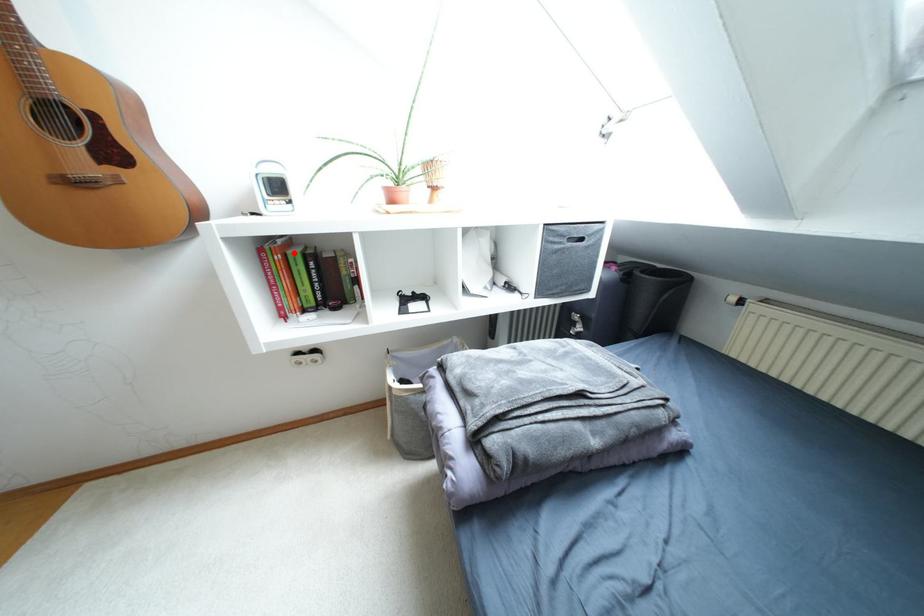
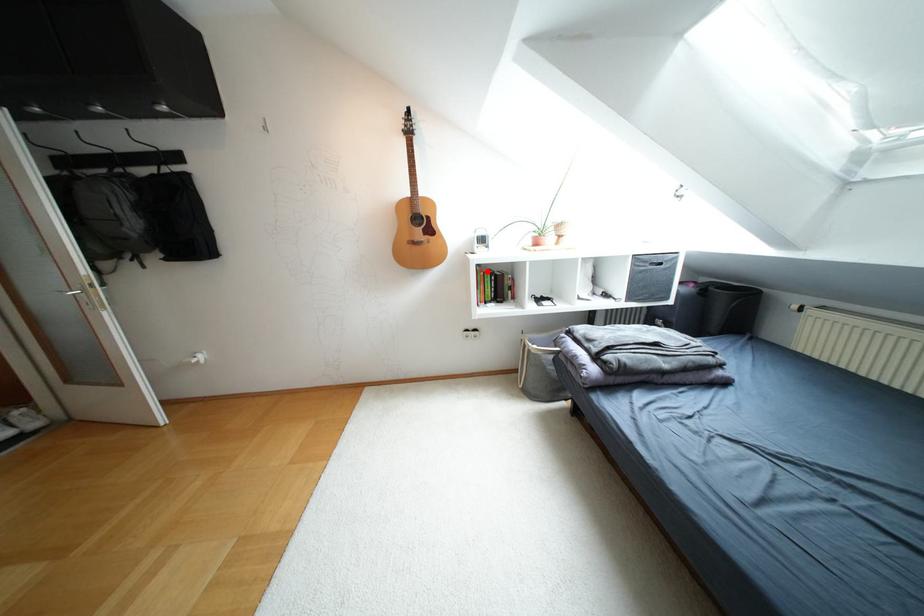
I am providing you with two images of the same scene from different viewpoints. A red point is marked on the first image and another point is marked on the second image. Are the points marked in image1 and image2 representing the same 3D position?

Yes